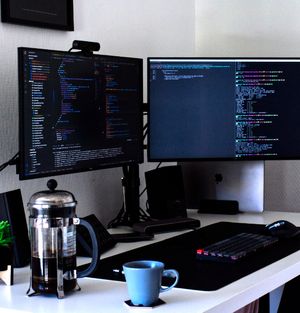
You are a GUI agent. You are given a task and a screenshot of the screen. Output one action in this format:
    pyautogui.click(x=<x>, y=<y>)
    Task: Click on the computer
    This screenshot has width=300, height=313.
    Given the screenshot: What is the action you would take?
    pyautogui.click(x=91, y=112)